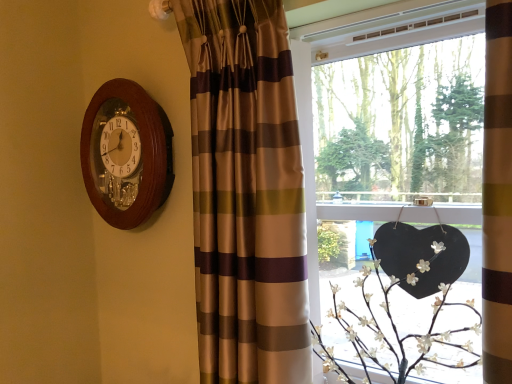
Question: Is wooden wall clock at upper left looking in the opposite direction of matte black heart at right?

Choices:
 (A) no
 (B) yes

Answer: (A)

Question: Is wooden wall clock at upper left far away from matte black heart at right?

Choices:
 (A) yes
 (B) no

Answer: (B)

Question: Does wooden wall clock at upper left turn towards matte black heart at right?

Choices:
 (A) yes
 (B) no

Answer: (B)

Question: Does wooden wall clock at upper left come in front of matte black heart at right?

Choices:
 (A) yes
 (B) no

Answer: (B)

Question: Considering the relative sizes of wooden wall clock at upper left and matte black heart at right in the image provided, is wooden wall clock at upper left wider than matte black heart at right?

Choices:
 (A) yes
 (B) no

Answer: (B)

Question: Considering the relative positions of white matte floral arrangement at lower right and brown striped curtain at left in the image provided, is white matte floral arrangement at lower right to the left or to the right of brown striped curtain at left?

Choices:
 (A) right
 (B) left

Answer: (A)

Question: Is white matte floral arrangement at lower right inside or outside of brown striped curtain at left?

Choices:
 (A) inside
 (B) outside

Answer: (B)

Question: From their relative heights in the image, would you say white matte floral arrangement at lower right is taller or shorter than brown striped curtain at left?

Choices:
 (A) tall
 (B) short

Answer: (B)

Question: Is white matte floral arrangement at lower right in front of or behind brown striped curtain at left in the image?

Choices:
 (A) behind
 (B) front

Answer: (B)

Question: From a real-world perspective, is wooden wall clock at upper left above or below white matte floral arrangement at lower right?

Choices:
 (A) below
 (B) above

Answer: (B)

Question: In the image, is wooden wall clock at upper left on the left side or the right side of white matte floral arrangement at lower right?

Choices:
 (A) left
 (B) right

Answer: (A)

Question: Considering the positions of wooden wall clock at upper left and white matte floral arrangement at lower right in the image, is wooden wall clock at upper left bigger or smaller than white matte floral arrangement at lower right?

Choices:
 (A) small
 (B) big

Answer: (A)

Question: Is wooden wall clock at upper left taller or shorter than white matte floral arrangement at lower right?

Choices:
 (A) short
 (B) tall

Answer: (B)

Question: From the image's perspective, is white matte floral arrangement at lower right located above or below wooden wall clock at upper left?

Choices:
 (A) below
 (B) above

Answer: (A)

Question: From a real-world perspective, is white matte floral arrangement at lower right physically located above or below wooden wall clock at upper left?

Choices:
 (A) above
 (B) below

Answer: (B)